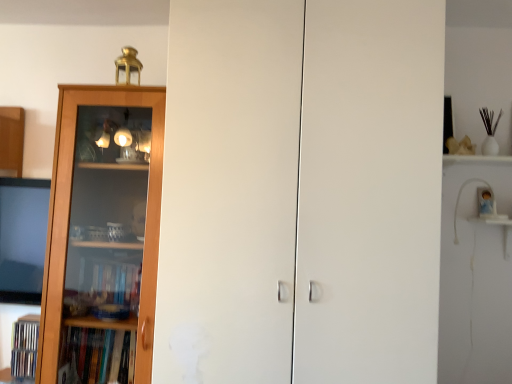
In order to click on white matte cabinet doors at center in this screenshot , I will do `click(370, 191)`.

What do you see at coordinates (370, 191) in the screenshot?
I see `white matte cabinet doors at center` at bounding box center [370, 191].

What is the approximate width of wooden bookcase at left?

It is 19.52 inches.

I want to click on wooden bookcase at left, so click(69, 215).

What do you see at coordinates (69, 215) in the screenshot?
I see `wooden bookcase at left` at bounding box center [69, 215].

Based on the photo, in order to face wooden bookcase at left, should I rotate leftwards or rightwards?

Turn left approximately 17.131 degrees to face it.

Locate an element on the screen. white matte cabinet doors at center is located at coordinates (370, 191).

Considering the positions of objects white matte cabinet doors at center and wooden bookcase at left in the image provided, who is more to the right, white matte cabinet doors at center or wooden bookcase at left?

Positioned to the right is white matte cabinet doors at center.

Considering their positions, is white matte cabinet doors at center located in front of or behind wooden bookcase at left?

Clearly, white matte cabinet doors at center is in front of wooden bookcase at left.

Which is behind, point (332, 161) or point (150, 88)?

The point (150, 88) is behind.

From the image's perspective, between white matte cabinet doors at center and wooden bookcase at left, which one is located above?

white matte cabinet doors at center, from the image's perspective.

From a real-world perspective, which object rests below the other?

wooden bookcase at left, from a real-world perspective.

Can you confirm if white matte cabinet doors at center is thinner than wooden bookcase at left?

In fact, white matte cabinet doors at center might be wider than wooden bookcase at left.

Looking at this image, considering the sizes of white matte cabinet doors at center and wooden bookcase at left in the image, is white matte cabinet doors at center taller or shorter than wooden bookcase at left?

In the image, white matte cabinet doors at center appears to be taller than wooden bookcase at left.

Based on the photo, considering the sizes of objects white matte cabinet doors at center and wooden bookcase at left in the image provided, who is smaller, white matte cabinet doors at center or wooden bookcase at left?

Smaller between the two is wooden bookcase at left.

Is white matte cabinet doors at center located outside wooden bookcase at left?

Yes, white matte cabinet doors at center is located beyond the bounds of wooden bookcase at left.

Are white matte cabinet doors at center and wooden bookcase at left located far from each other?

No, there isn't a large distance between white matte cabinet doors at center and wooden bookcase at left.

Is white matte cabinet doors at center oriented away from wooden bookcase at left?

white matte cabinet doors at center does not have its back to wooden bookcase at left.

Can you tell me how much white matte cabinet doors at center and wooden bookcase at left differ in facing direction?

The angle between the facing direction of white matte cabinet doors at center and the facing direction of wooden bookcase at left is 2.42 degrees.

Locate an element on the screen. Image resolution: width=512 pixels, height=384 pixels. screen door that appears in front of the wooden bookcase at left is located at coordinates (370, 191).

Is wooden bookcase at left at the left side of white matte cabinet doors at center?

Yes, wooden bookcase at left is to the left of white matte cabinet doors at center.

Is the position of wooden bookcase at left less distant than that of white matte cabinet doors at center?

No, wooden bookcase at left is behind white matte cabinet doors at center.

Does point (66, 218) come farther from viewer compared to point (428, 163)?

Yes, it is.

From the image's perspective, which one is positioned higher, wooden bookcase at left or white matte cabinet doors at center?

white matte cabinet doors at center appears higher in the image.

From a real-world perspective, is wooden bookcase at left under white matte cabinet doors at center?

Yes, from a real-world perspective, wooden bookcase at left is below white matte cabinet doors at center.

In terms of width, does wooden bookcase at left look wider or thinner when compared to white matte cabinet doors at center?

Considering their sizes, wooden bookcase at left looks slimmer than white matte cabinet doors at center.

Is wooden bookcase at left taller than white matte cabinet doors at center?

No, wooden bookcase at left is not taller than white matte cabinet doors at center.

Does wooden bookcase at left have a larger size compared to white matte cabinet doors at center?

No, wooden bookcase at left is not bigger than white matte cabinet doors at center.

Is wooden bookcase at left positioned beyond the bounds of white matte cabinet doors at center?

Yes, wooden bookcase at left is not within white matte cabinet doors at center.

Is wooden bookcase at left beside white matte cabinet doors at center?

wooden bookcase at left and white matte cabinet doors at center are not in contact.

Could you tell me if wooden bookcase at left is facing white matte cabinet doors at center?

No.

How many degrees apart are the facing directions of wooden bookcase at left and white matte cabinet doors at center?

The angle between the facing direction of wooden bookcase at left and the facing direction of white matte cabinet doors at center is 2.42 degrees.

Locate an element on the screen. This screenshot has width=512, height=384. screen door on the right of the wooden bookcase at left is located at coordinates (x=370, y=191).

Locate an element on the screen. screen door that appears on the right of wooden bookcase at left is located at coordinates (370, 191).

This screenshot has height=384, width=512. In order to click on bookcase behind the white matte cabinet doors at center in this screenshot , I will do `click(69, 215)`.